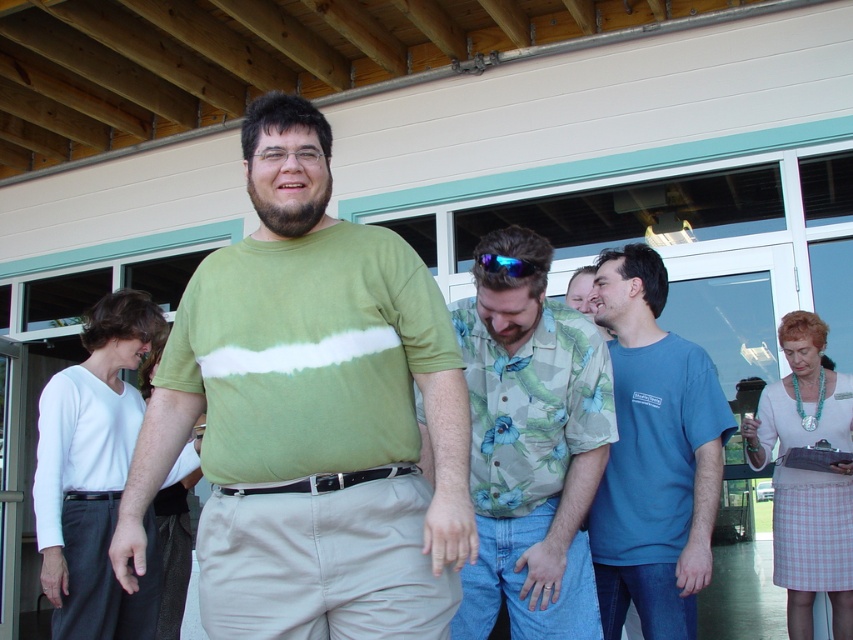
Looking at this image, which is below, blue cotton t-shirt at center or blue reflective lens at center?

blue cotton t-shirt at center

Is point (683, 602) behind point (479, 253)?

Yes, it is behind point (479, 253).

Is point (659, 342) positioned behind point (502, 256)?

That is True.

This screenshot has width=853, height=640. Find the location of `blue cotton t-shirt at center`. blue cotton t-shirt at center is located at coordinates (654, 456).

Where is `floral print shirt at center`? The height and width of the screenshot is (640, 853). floral print shirt at center is located at coordinates (531, 449).

Which is behind, point (531, 490) or point (822, 525)?

Positioned behind is point (822, 525).

Is point (564, 563) behind point (840, 577)?

No, (564, 563) is closer to viewer.

This screenshot has height=640, width=853. In order to click on floral print shirt at center in this screenshot , I will do `click(531, 449)`.

Is point (711, 490) farther from viewer compared to point (62, 634)?

That is False.

Is blue cotton t-shirt at center wider than white matte shirt at left?

No.

Measure the distance between blue cotton t-shirt at center and camera.

A distance of 2.84 meters exists between blue cotton t-shirt at center and camera.

At what (x,y) coordinates should I click in order to perform the action: click on blue cotton t-shirt at center. Please return your answer as a coordinate pair (x, y). Looking at the image, I should click on (654, 456).